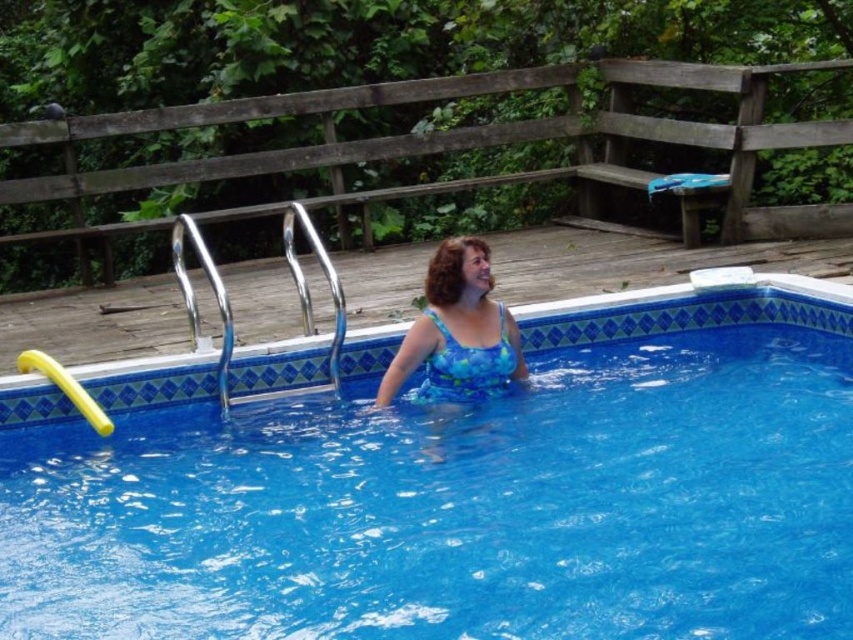
Which is below, blue glossy water at center or blue printed swimsuit at center?

blue glossy water at center

In the scene shown: Who is more forward, (x=259, y=490) or (x=381, y=406)?

Positioned in front is point (x=259, y=490).

Describe the element at coordinates (460, 490) in the screenshot. The height and width of the screenshot is (640, 853). I see `blue glossy water at center` at that location.

Identify the location of blue glossy water at center. The width and height of the screenshot is (853, 640). (460, 490).